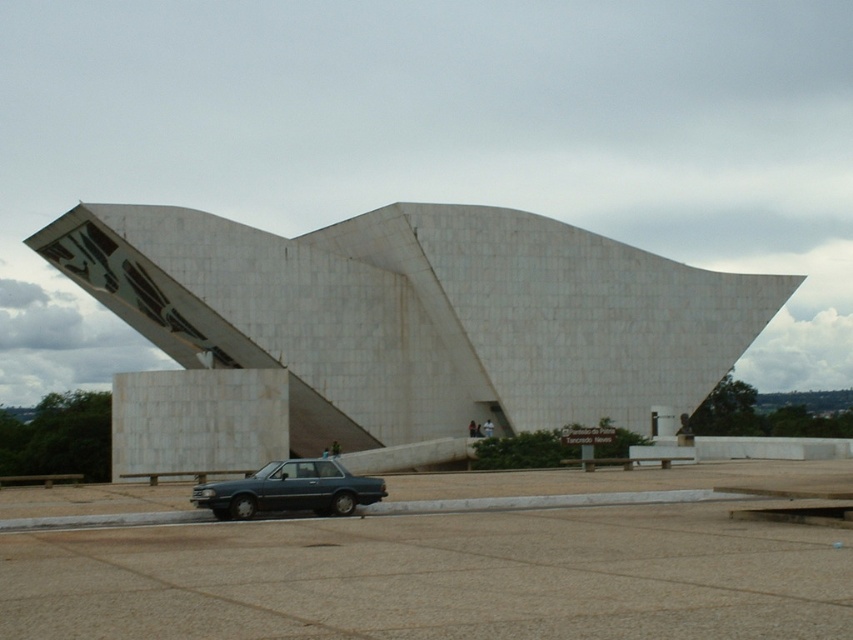
Does white marble building at center appear on the left side of matte blue sedan at lower center?

No, white marble building at center is not to the left of matte blue sedan at lower center.

The width and height of the screenshot is (853, 640). What do you see at coordinates (421, 314) in the screenshot? I see `white marble building at center` at bounding box center [421, 314].

I want to click on white marble building at center, so click(421, 314).